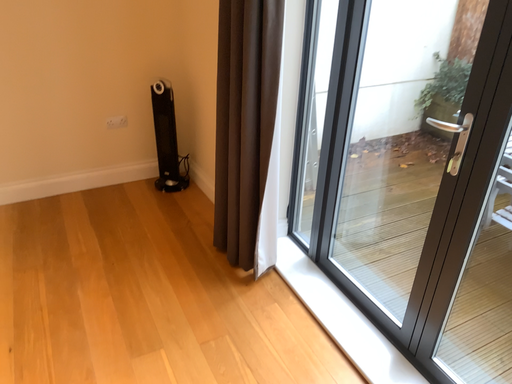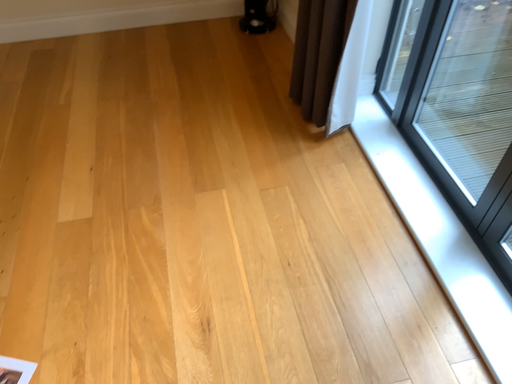
Question: How did the camera likely rotate when shooting the video?

Choices:
 (A) rotated upward
 (B) rotated downward

Answer: (B)